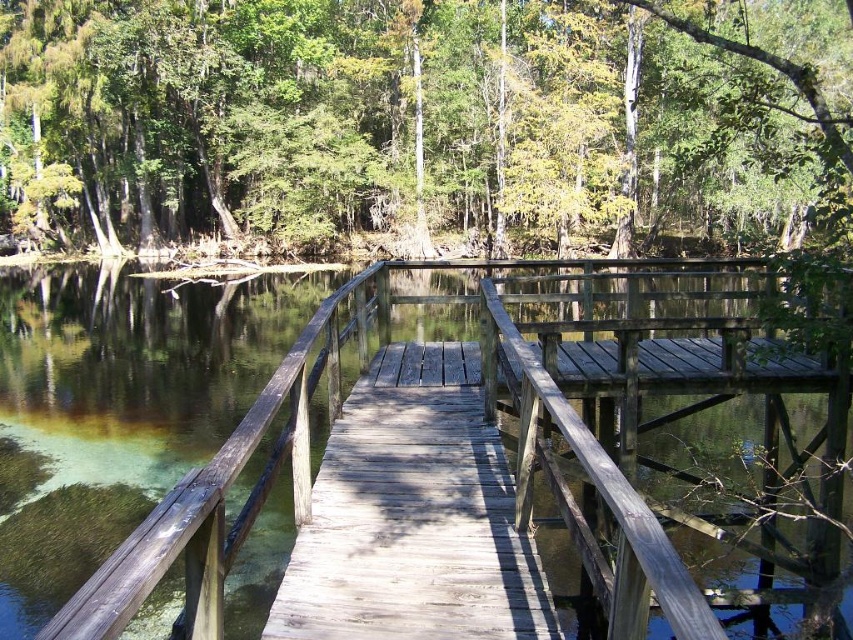
Which is more to the left, green matte tree at upper center or weathered wood bridge at center?

green matte tree at upper center

Which of these two, green matte tree at upper center or weathered wood bridge at center, stands taller?

With more height is green matte tree at upper center.

This screenshot has width=853, height=640. I want to click on green matte tree at upper center, so click(x=425, y=122).

In order to click on green matte tree at upper center in this screenshot , I will do `click(425, 122)`.